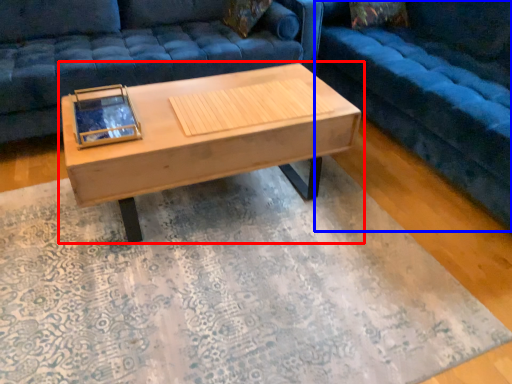
Question: Which point is further to the camera, coffee table (highlighted by a red box) or studio couch (highlighted by a blue box)?

Choices:
 (A) coffee table
 (B) studio couch

Answer: (A)